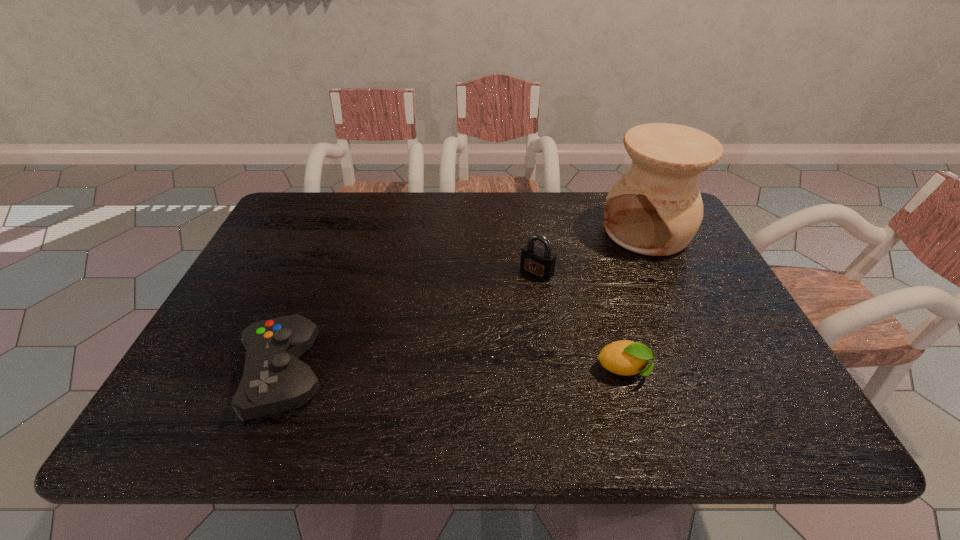
Where is `vacant space in between the leftmost object and the lemon`? The width and height of the screenshot is (960, 540). vacant space in between the leftmost object and the lemon is located at coordinates (454, 373).

At what (x,y) coordinates should I click in order to perform the action: click on vacant area that lies between the pottery and the lemon. Please return your answer as a coordinate pair (x, y). Image resolution: width=960 pixels, height=540 pixels. Looking at the image, I should click on coord(636,301).

This screenshot has height=540, width=960. Identify the location of vacant area between the second tallest object and the lemon. (581, 321).

Locate an element on the screen. unoccupied position between the second farthest object and the lemon is located at coordinates (581, 321).

Locate an element on the screen. vacant area between the farthest object and the lemon is located at coordinates (636, 301).

Locate an element on the screen. This screenshot has height=540, width=960. blank region between the tallest object and the second tallest object is located at coordinates [591, 252].

Where is `free point between the lemon and the third object from right to left`? free point between the lemon and the third object from right to left is located at coordinates (581, 321).

Select which object is the closest to the lemon. Please provide its 2D coordinates. Your answer should be formatted as a tuple, i.e. [(x, y)], where the tuple contains the x and y coordinates of a point satisfying the conditions above.

[(536, 261)]

Locate which object ranks in proximity to the lemon. Please provide its 2D coordinates. Your answer should be formatted as a tuple, i.e. [(x, y)], where the tuple contains the x and y coordinates of a point satisfying the conditions above.

[(536, 261)]

Find the location of `vacant region that satisfies the following two spatial constraints: 1. on the back side of the farthest object; 2. on the right side of the third nearest object`. vacant region that satisfies the following two spatial constraints: 1. on the back side of the farthest object; 2. on the right side of the third nearest object is located at coordinates (531, 232).